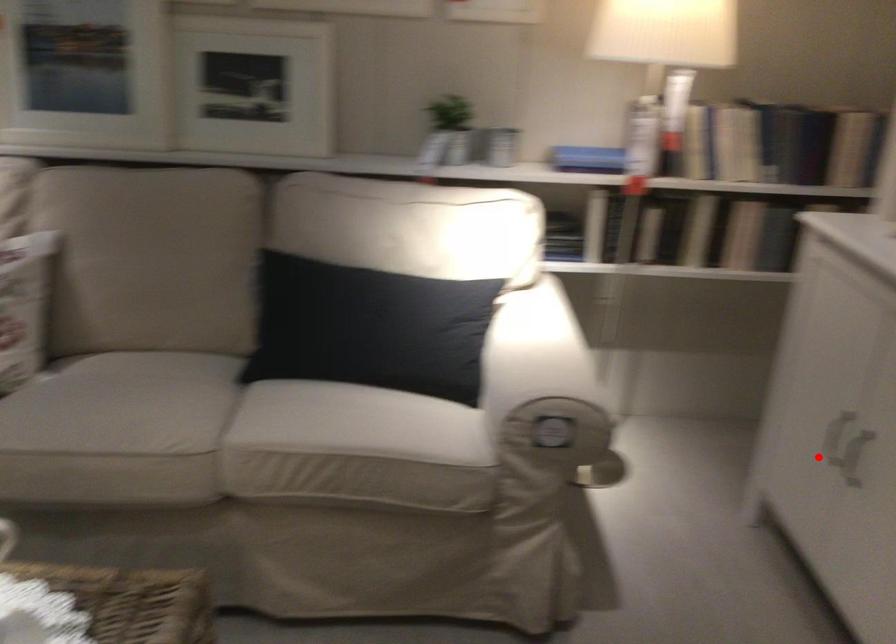
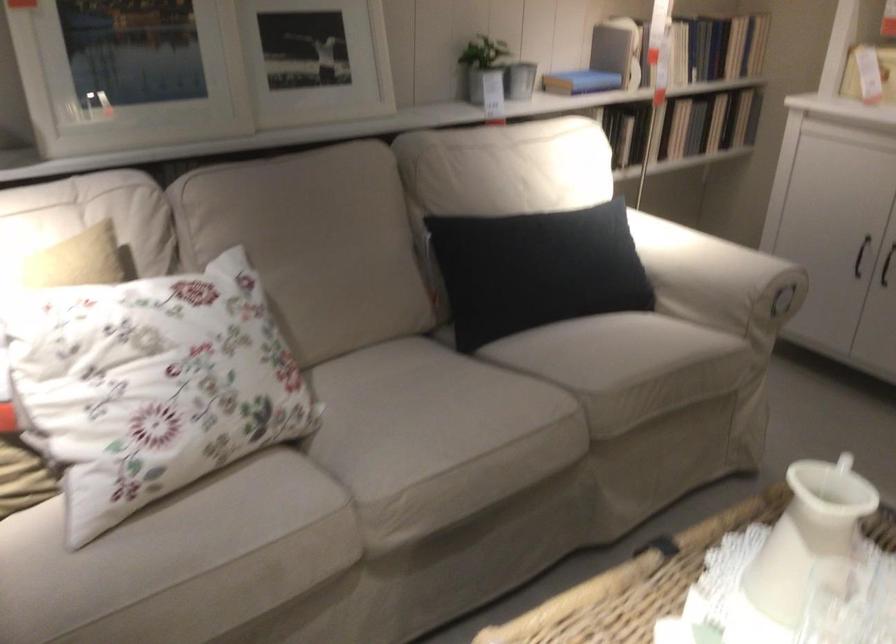
Question: A red point is marked in image1. In image2, is the corresponding 3D point closer to the camera or farther? Reply with the corresponding letter.

Choices:
 (A) The corresponding 3D point is closer.
 (B) The corresponding 3D point is farther.

Answer: (B)